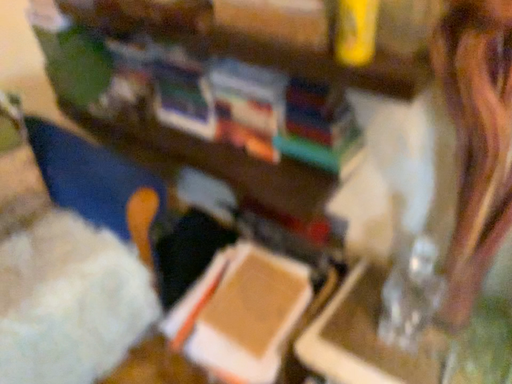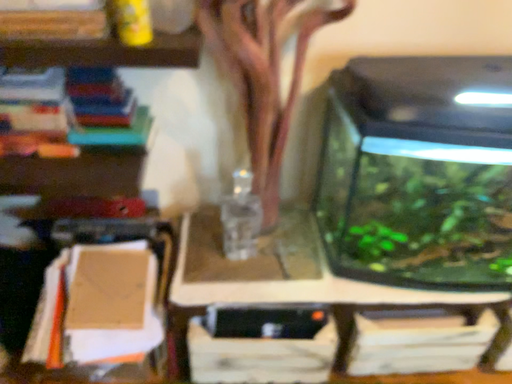
Question: Which way did the camera rotate in the video?

Choices:
 (A) rotated downward
 (B) rotated upward

Answer: (B)